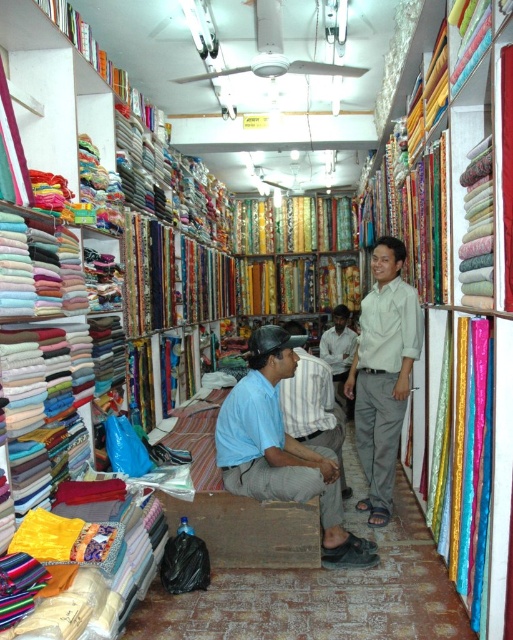
You are a customer in the fabric shop and want to buy a shirt that can fit over a size 10. Which shirt between the light beige cotton shirt at center and the light brown shirt at center would be more suitable?

The light beige cotton shirt at center has a larger size compared to the light brown shirt at center, so it would be more suitable for fitting over a size 10.

You are standing in the fabric shop and see two points marked on the floor. The first point is at coordinate point(366,561) and the second is at point(326,339). If you were to walk from the entrance towards the back of the shop, which point would you encounter first?

Point(326,339) would be encountered first because it is closer to the entrance than point(366,561), which is further back in the shop.